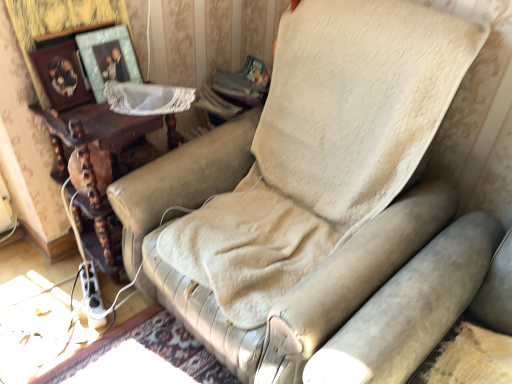
Question: Is brown wooden table at left at the right side of wooden photo frame at upper left, which is the first picture frame in left-to-right order?

Choices:
 (A) yes
 (B) no

Answer: (A)

Question: Is the position of brown wooden table at left less distant than that of wooden photo frame at upper left, which appears as the second picture frame when viewed from the right?

Choices:
 (A) yes
 (B) no

Answer: (B)

Question: Does brown wooden table at left have a lesser width compared to wooden photo frame at upper left, which appears as the second picture frame when viewed from the right?

Choices:
 (A) no
 (B) yes

Answer: (A)

Question: From the image's perspective, does brown wooden table at left appear higher than wooden photo frame at upper left, which is the first picture frame in left-to-right order?

Choices:
 (A) yes
 (B) no

Answer: (B)

Question: Is brown wooden table at left bigger than wooden photo frame at upper left, which is the first picture frame in left-to-right order?

Choices:
 (A) no
 (B) yes

Answer: (B)

Question: Does brown wooden table at left have a greater width compared to wooden photo frame at upper left, which appears as the second picture frame when viewed from the right?

Choices:
 (A) yes
 (B) no

Answer: (A)

Question: Is the position of metallic silver picture frame at upper left, which appears as the second picture frame when viewed from the left, less distant than that of brown wooden table at left?

Choices:
 (A) no
 (B) yes

Answer: (A)

Question: Considering the relative sizes of metallic silver picture frame at upper left, which ranks as the 1th picture frame in right-to-left order, and brown wooden table at left in the image provided, is metallic silver picture frame at upper left, which ranks as the 1th picture frame in right-to-left order, thinner than brown wooden table at left?

Choices:
 (A) no
 (B) yes

Answer: (B)

Question: Is metallic silver picture frame at upper left, which ranks as the 1th picture frame in right-to-left order, bigger than brown wooden table at left?

Choices:
 (A) no
 (B) yes

Answer: (A)

Question: Is metallic silver picture frame at upper left, which ranks as the 1th picture frame in right-to-left order, oriented towards brown wooden table at left?

Choices:
 (A) yes
 (B) no

Answer: (B)

Question: Is metallic silver picture frame at upper left, which appears as the second picture frame when viewed from the left, smaller than brown wooden table at left?

Choices:
 (A) yes
 (B) no

Answer: (A)

Question: Can we say metallic silver picture frame at upper left, which ranks as the 1th picture frame in right-to-left order, lies outside brown wooden table at left?

Choices:
 (A) no
 (B) yes

Answer: (B)

Question: From a real-world perspective, is wooden photo frame at upper left, which appears as the second picture frame when viewed from the right, located beneath brown wooden table at left?

Choices:
 (A) yes
 (B) no

Answer: (B)